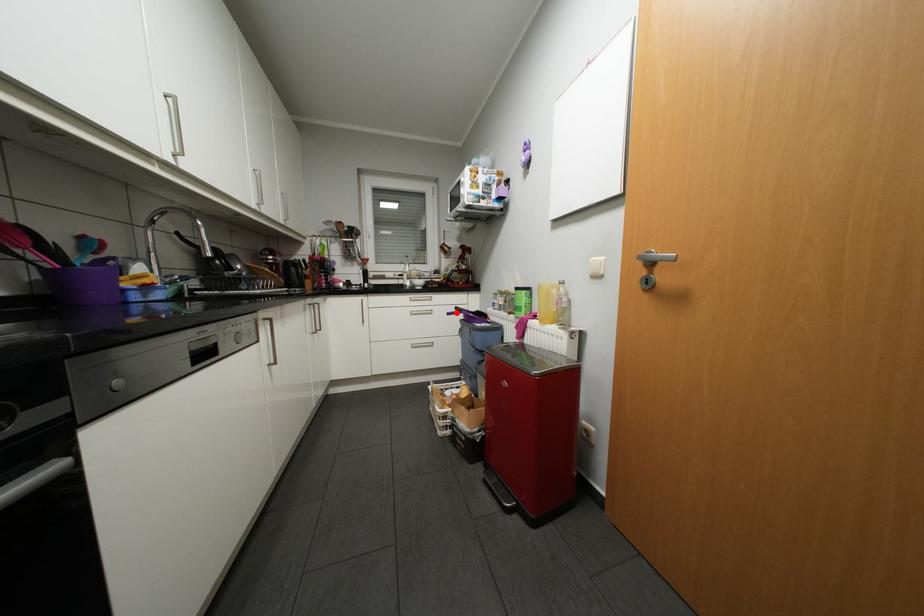
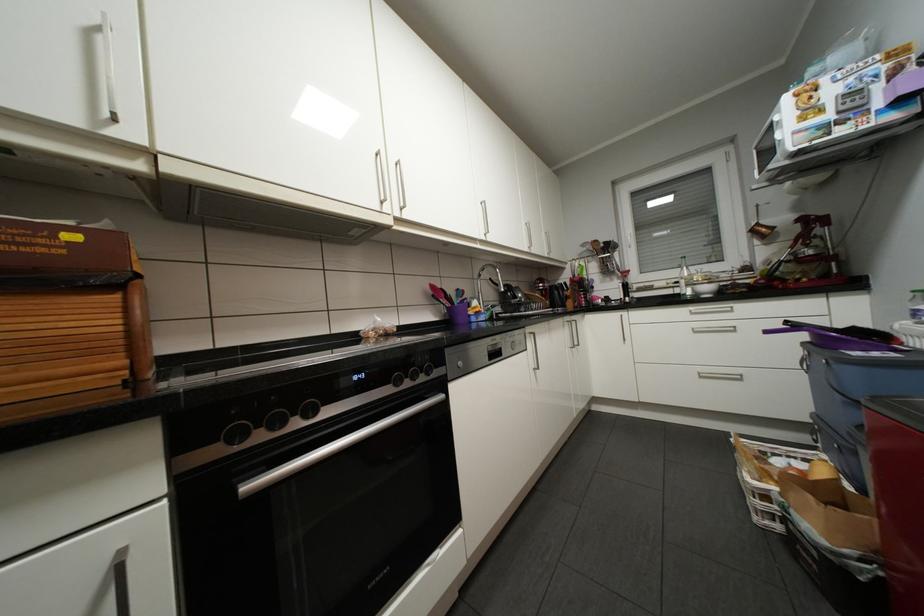
The point at the highlighted location is marked in the first image. Where is the corresponding point in the second image?

(775, 331)